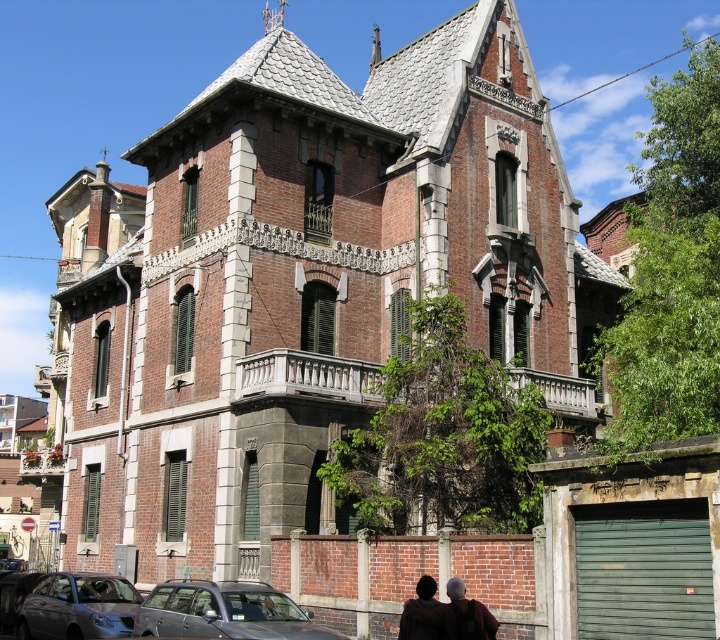
Between metallic gray sedan at lower left and matte brown hair at lower center, which one is positioned lower?

Positioned lower is metallic gray sedan at lower left.

Looking at this image, is metallic gray sedan at lower left to the left of matte brown hair at lower center from the viewer's perspective?

Indeed, metallic gray sedan at lower left is positioned on the left side of matte brown hair at lower center.

At what (x,y) coordinates should I click in order to perform the action: click on metallic gray sedan at lower left. Please return your answer as a coordinate pair (x, y). The width and height of the screenshot is (720, 640). Looking at the image, I should click on (78, 608).

Which is more to the right, matte gray car at lower left or metallic gray sedan at lower left?

matte gray car at lower left

Is point (206, 605) farther from viewer compared to point (60, 593)?

No.

This screenshot has height=640, width=720. I want to click on matte gray car at lower left, so (224, 612).

Does matte gray car at lower left appear over matte brown hair at lower center?

Incorrect, matte gray car at lower left is not positioned above matte brown hair at lower center.

Is matte gray car at lower left behind matte brown hair at lower center?

Yes, matte gray car at lower left is behind matte brown hair at lower center.

Is point (246, 580) positioned in front of point (441, 625)?

No, it is not.

Image resolution: width=720 pixels, height=640 pixels. Find the location of `matte gray car at lower left`. matte gray car at lower left is located at coordinates (224, 612).